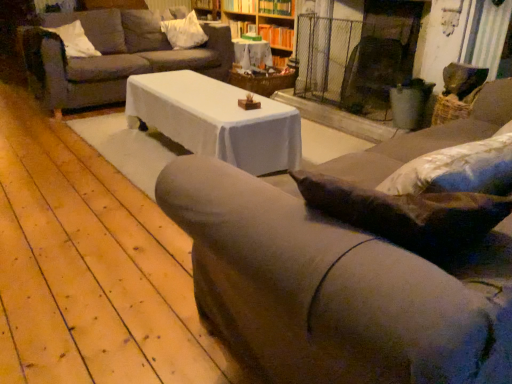
Question: From the image's perspective, does wooden bookshelf at upper center, marked as the first shelf in a top-to-bottom arrangement, appear lower than white fabric pillow at upper center, which is the first pillow in back-to-front order?

Choices:
 (A) no
 (B) yes

Answer: (A)

Question: From a real-world perspective, does wooden bookshelf at upper center, the second shelf ordered from the bottom, sit lower than white fabric pillow at upper center, marked as the 1th pillow in a right-to-left arrangement?

Choices:
 (A) yes
 (B) no

Answer: (B)

Question: Is wooden bookshelf at upper center, marked as the first shelf in a top-to-bottom arrangement, turned away from white fabric pillow at upper center, which is the first pillow in back-to-front order?

Choices:
 (A) yes
 (B) no

Answer: (B)

Question: Can white fabric pillow at upper center, marked as the 2th pillow in a left-to-right arrangement, be found inside wooden bookshelf at upper center, marked as the first shelf in a top-to-bottom arrangement?

Choices:
 (A) yes
 (B) no

Answer: (B)

Question: Does wooden bookshelf at upper center, the second shelf ordered from the bottom, appear on the left side of white fabric pillow at upper center, the 2th pillow viewed from the front?

Choices:
 (A) no
 (B) yes

Answer: (A)

Question: Is wooden bookshelf at upper center, marked as the first shelf in a top-to-bottom arrangement, in front of white fabric pillow at upper center, marked as the 1th pillow in a right-to-left arrangement?

Choices:
 (A) no
 (B) yes

Answer: (A)

Question: Is the depth of wooden bookshelf at upper center greater than that of wooden bookshelf at upper center, marked as the second shelf in a top-to-bottom arrangement?

Choices:
 (A) yes
 (B) no

Answer: (B)

Question: Is wooden bookshelf at upper center shorter than wooden bookshelf at upper center, the 1th shelf from the bottom?

Choices:
 (A) yes
 (B) no

Answer: (B)

Question: From a real-world perspective, is wooden bookshelf at upper center on top of wooden bookshelf at upper center, marked as the second shelf in a top-to-bottom arrangement?

Choices:
 (A) yes
 (B) no

Answer: (B)

Question: From the image's perspective, would you say wooden bookshelf at upper center is positioned over wooden bookshelf at upper center, the 1th shelf from the bottom?

Choices:
 (A) no
 (B) yes

Answer: (B)

Question: Is wooden bookshelf at upper center taller than wooden bookshelf at upper center, marked as the second shelf in a top-to-bottom arrangement?

Choices:
 (A) no
 (B) yes

Answer: (B)

Question: Is wooden bookshelf at upper center in contact with wooden bookshelf at upper center, the 1th shelf from the bottom?

Choices:
 (A) yes
 (B) no

Answer: (B)

Question: Considering the relative sizes of wooden textured table at center and velvet brown couch at center, acting as the second studio couch starting from the back, in the image provided, is wooden textured table at center wider than velvet brown couch at center, acting as the second studio couch starting from the back,?

Choices:
 (A) no
 (B) yes

Answer: (A)